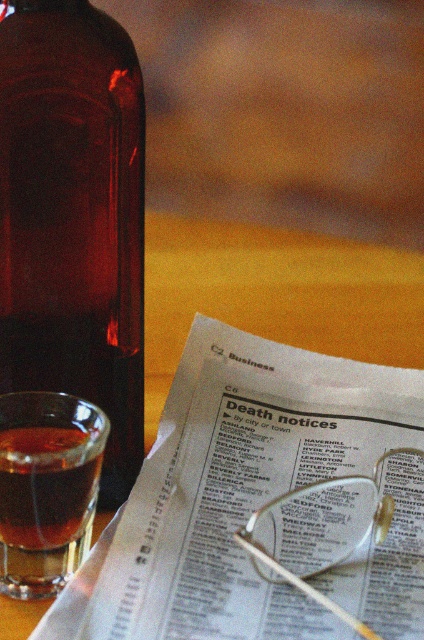
You are a GUI agent. You are given a task and a screenshot of the screen. Output one action in this format:
    pyautogui.click(x=<x>, y=<y>)
    Task: Click on the white glossy newspaper at center
    This screenshot has width=424, height=640.
    Given the screenshot: What is the action you would take?
    (x=257, y=499)

Can you confirm if white glossy newspaper at center is shorter than brown glass bottle at left?

Yes, white glossy newspaper at center is shorter than brown glass bottle at left.

Which is in front, point (208, 552) or point (137, 305)?

Point (208, 552)

The image size is (424, 640). I want to click on white glossy newspaper at center, so click(257, 499).

How far apart are white glossy newspaper at center and translucent amber glass at left?

A distance of 5.54 centimeters exists between white glossy newspaper at center and translucent amber glass at left.

Between white glossy newspaper at center and translucent amber glass at left, which one appears on the left side from the viewer's perspective?

translucent amber glass at left is more to the left.

Locate an element on the screen. white glossy newspaper at center is located at coordinates (257, 499).

Locate an element on the screen. white glossy newspaper at center is located at coordinates (257, 499).

Is brown glass bottle at left further to the viewer compared to translucent amber glass at left?

Yes, it is behind translucent amber glass at left.

Does brown glass bottle at left have a greater height compared to translucent amber glass at left?

Yes, brown glass bottle at left is taller than translucent amber glass at left.

You are a GUI agent. You are given a task and a screenshot of the screen. Output one action in this format:
    pyautogui.click(x=<x>, y=<y>)
    Task: Click on the brown glass bottle at left
    
    Given the screenshot: What is the action you would take?
    pyautogui.click(x=74, y=218)

Find the location of a particular element. The width and height of the screenshot is (424, 640). brown glass bottle at left is located at coordinates (74, 218).